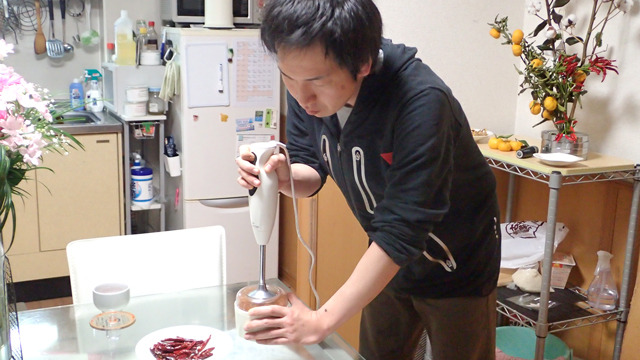
Find the location of a particular element. This screenshot has height=360, width=640. sink is located at coordinates (x=86, y=121).